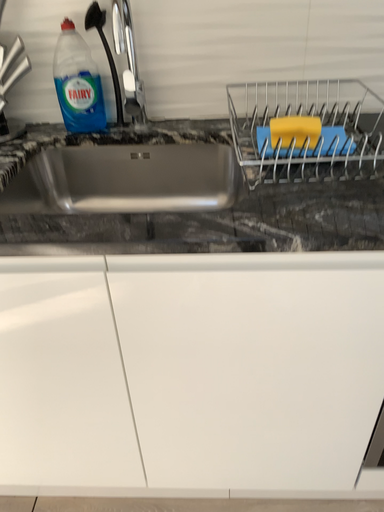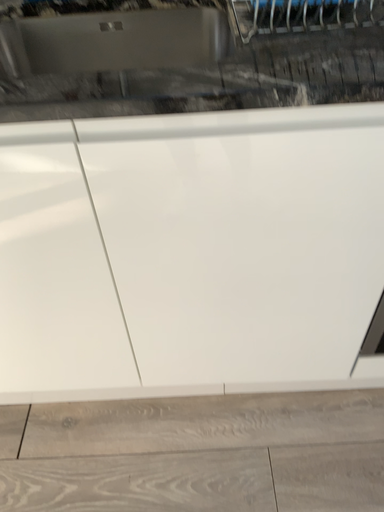
Question: How did the camera likely rotate when shooting the video?

Choices:
 (A) rotated downward
 (B) rotated upward

Answer: (A)